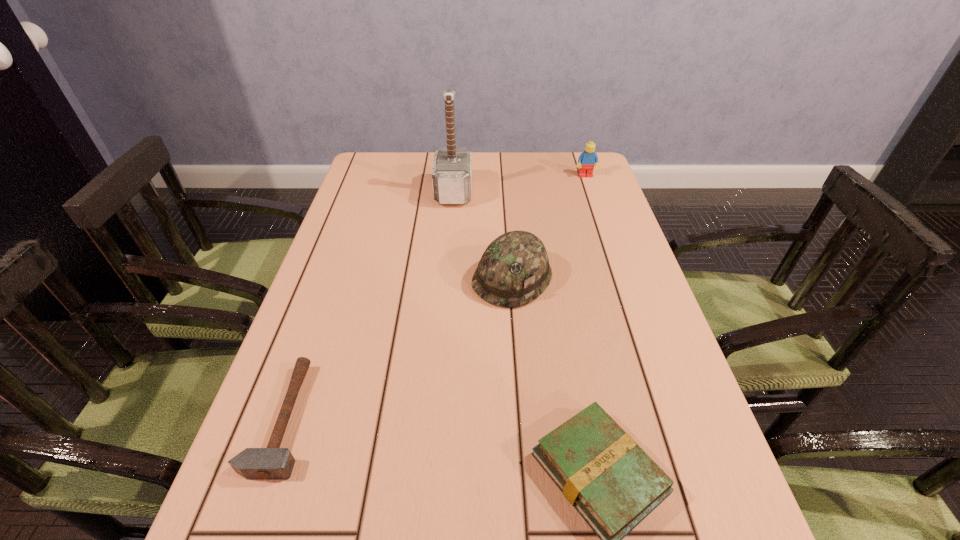
Locate an element on the screen. This screenshot has width=960, height=540. the fourth object from right to left is located at coordinates (452, 168).

You are a GUI agent. You are given a task and a screenshot of the screen. Output one action in this format:
    pyautogui.click(x=<x>, y=<y>)
    Task: Click on the farther hammer
    This screenshot has width=960, height=540.
    Given the screenshot: What is the action you would take?
    pyautogui.click(x=452, y=168)

Locate an element on the screen. The width and height of the screenshot is (960, 540). Lego is located at coordinates (588, 158).

The image size is (960, 540). I want to click on the third nearest object, so click(x=514, y=270).

You are a GUI agent. You are given a task and a screenshot of the screen. Output one action in this format:
    pyautogui.click(x=<x>, y=<y>)
    Task: Click on the nearer hammer
    Image resolution: width=960 pixels, height=540 pixels.
    Given the screenshot: What is the action you would take?
    pyautogui.click(x=272, y=463)

Locate an element on the screen. This screenshot has width=960, height=540. the shorter hammer is located at coordinates (272, 463).

Identify the location of vacant space located for striking with the head of the tallest object. The height and width of the screenshot is (540, 960). [598, 192].

Locate an element on the screen. The width and height of the screenshot is (960, 540). free location located on the face of the Lego is located at coordinates (604, 230).

This screenshot has width=960, height=540. I want to click on free space located 0.370m on the front of the headwear, so click(x=527, y=474).

Where is `vacant area situated on the striking surface of the shorter hammer`? vacant area situated on the striking surface of the shorter hammer is located at coordinates (364, 418).